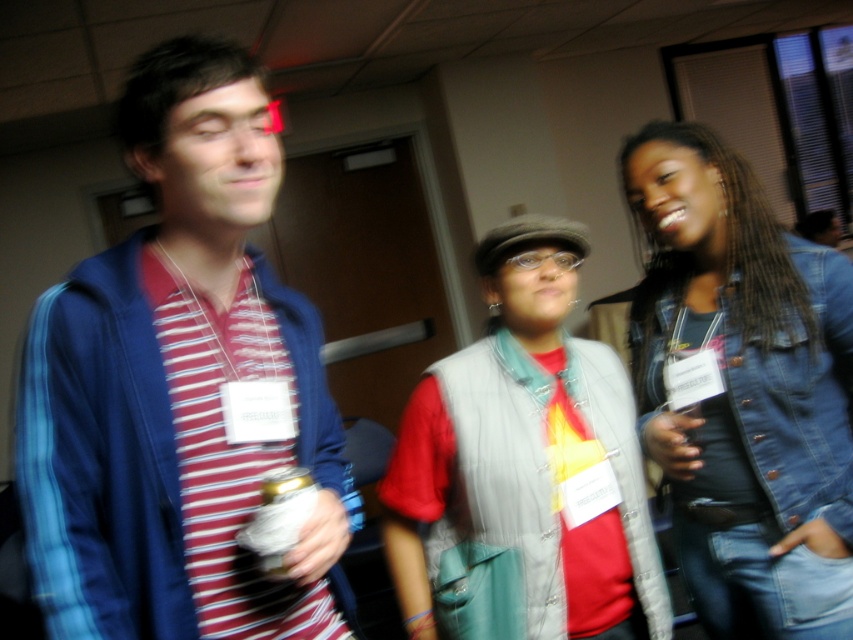
You are standing in the conference room and want to hand a document to the person wearing the gray fabric vest at center without walking past the blue striped shirt at left. Is this possible?

The blue striped shirt at left is closer to the viewer than the gray fabric vest at center, so you can hand the document to the gray fabric vest at center without needing to walk past the blue striped shirt at left by approaching from the side or behind.

You are standing in a room with three people. There is a point at coordinates (267,336). Can you estimate how far this point is from you?

The point at coordinates (267,336) is 39.08 inches away from you.